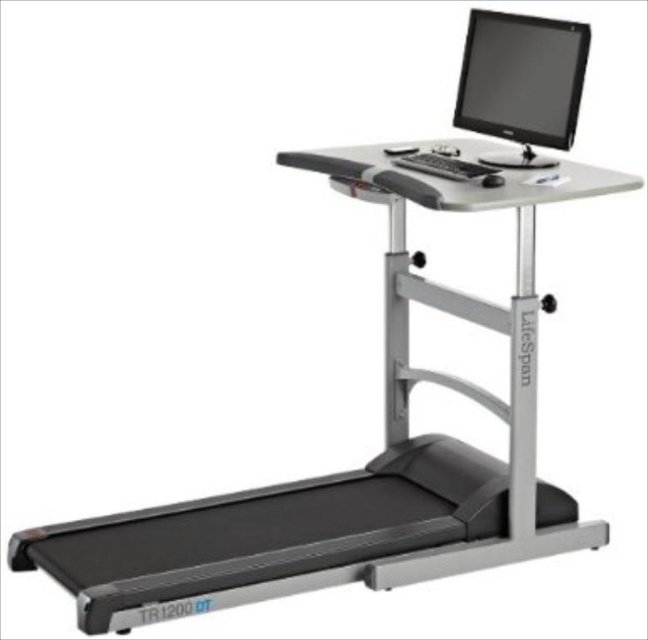
Question: Can you confirm if black glossy monitor at upper center is positioned to the right of black plastic mouse at upper center?

Choices:
 (A) no
 (B) yes

Answer: (B)

Question: Which object appears closest to the camera in this image?

Choices:
 (A) black plastic mouse at upper center
 (B) black glossy monitor at upper center

Answer: (A)

Question: Which is nearer to the black plastic mouse at upper center?

Choices:
 (A) black glossy monitor at upper center
 (B) black matte keyboard at upper center

Answer: (B)

Question: Can you confirm if black glossy monitor at upper center is positioned above black plastic mouse at upper center?

Choices:
 (A) yes
 (B) no

Answer: (A)

Question: Is black glossy monitor at upper center behind black plastic mouse at upper center?

Choices:
 (A) no
 (B) yes

Answer: (B)

Question: Which object is farther from the camera taking this photo?

Choices:
 (A) black plastic mouse at upper center
 (B) black glossy monitor at upper center
 (C) black matte keyboard at upper center

Answer: (B)